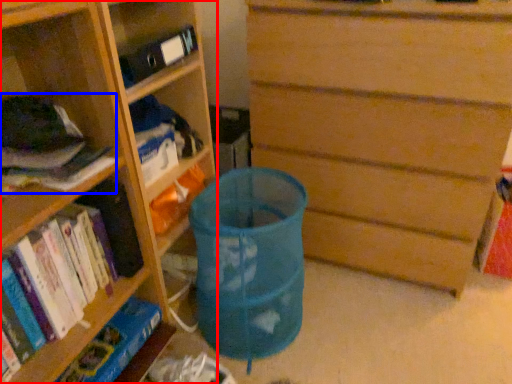
Question: Which of the following is the closest to the observer, shelf (highlighted by a red box) or book (highlighted by a blue box)?

Choices:
 (A) shelf
 (B) book

Answer: (B)